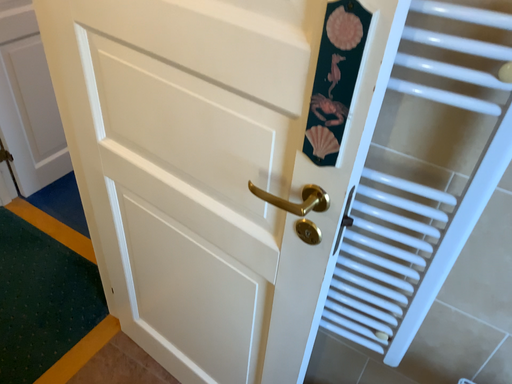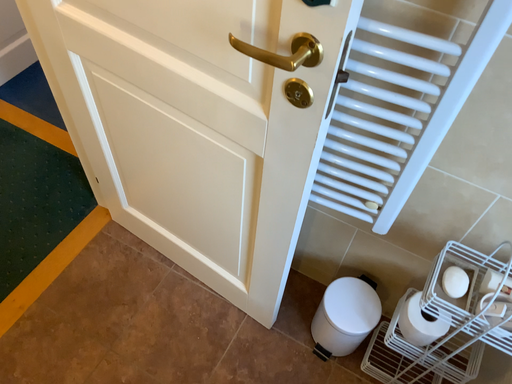
Question: How did the camera likely rotate when shooting the video?

Choices:
 (A) rotated downward
 (B) rotated upward

Answer: (A)